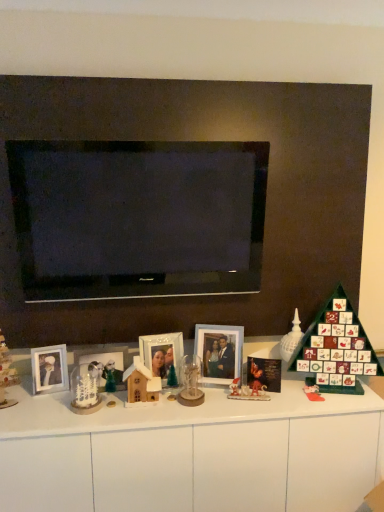
The height and width of the screenshot is (512, 384). What are the coordinates of `spots to the right of matte plastic toy at right, arranged as the second toy when viewed from the back` in the screenshot? It's located at (347, 397).